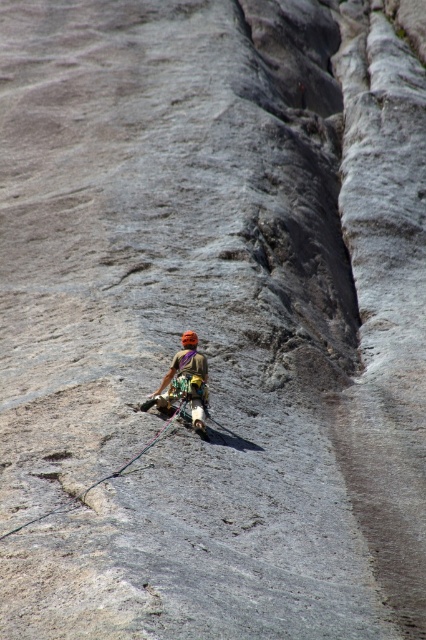
Question: Does matte orange helmet at center have a smaller size compared to black nylon rope at center?

Choices:
 (A) yes
 (B) no

Answer: (B)

Question: Which of the following is the farthest from the observer?

Choices:
 (A) click(x=146, y=406)
 (B) click(x=152, y=438)

Answer: (A)

Question: From the image, what is the correct spatial relationship of matte orange helmet at center in relation to black nylon rope at center?

Choices:
 (A) above
 (B) below

Answer: (A)

Question: Can you confirm if matte orange helmet at center is bigger than black nylon rope at center?

Choices:
 (A) yes
 (B) no

Answer: (A)